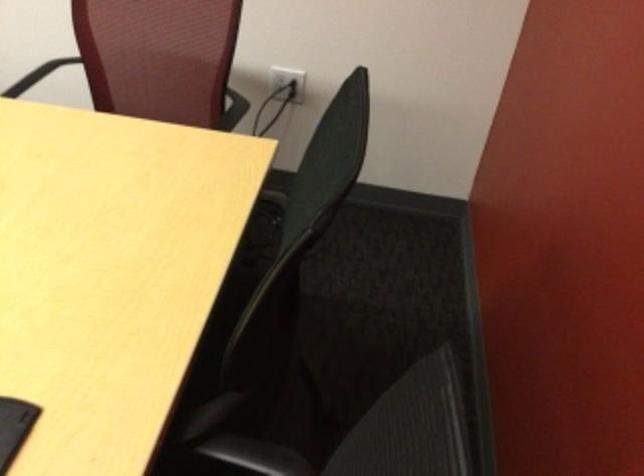
Find where to sit the chair sitting surface. Please return your answer as a coordinate pair (x, y).

(232, 441)